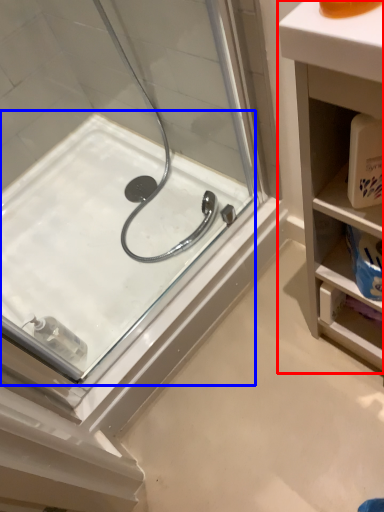
Question: Which of the following is the closest to the observer, bathroom cabinet (highlighted by a red box) or bath (highlighted by a blue box)?

Choices:
 (A) bathroom cabinet
 (B) bath

Answer: (A)